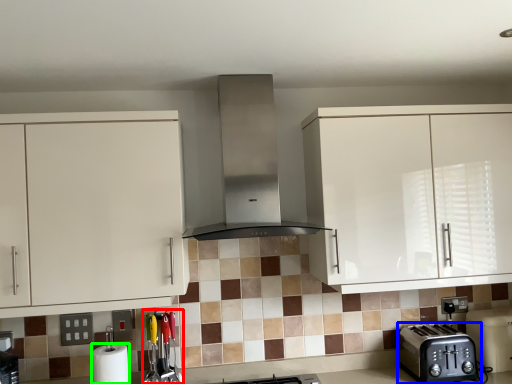
Question: Which is farther away from appliance (highlighted by a red box)? toaster (highlighted by a blue box) or paper towel (highlighted by a green box)?

Choices:
 (A) toaster
 (B) paper towel

Answer: (A)